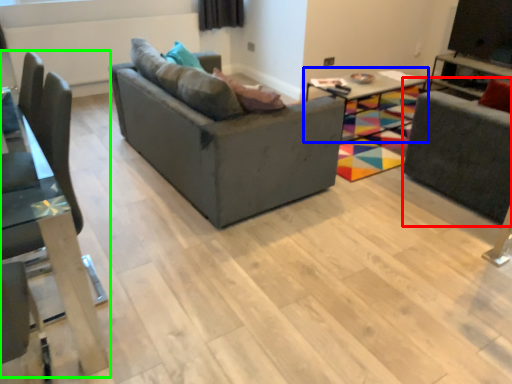
Question: Considering the real-world distances, which object is closest to swivel chair (highlighted by a red box)? table (highlighted by a blue box) or chair (highlighted by a green box).

Choices:
 (A) table
 (B) chair

Answer: (A)